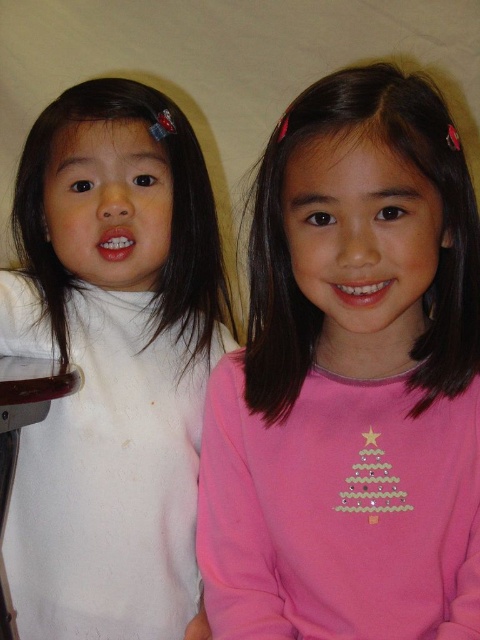
You are a photographer setting up for a group photo. You have two children in front of you, one wearing a pink matte shirt at center and the other wearing a white soft sweater at left. To ensure both are framed properly, which child should you position closer to the camera to make them appear the same height in the photo?

The pink matte shirt at center is not as tall as the white soft sweater at left, so you should position the child in the pink matte shirt at center closer to the camera to make them appear the same height in the photo.

You are taking a photo of two children in a room with a plain light wall. You notice two points marked in the image. The first point is at coordinate point [395,609] and the second is at point [60,97]. Which point is nearer to the camera?

Point [395,609] is closer to the camera than point [60,97] according to the description.

You are a photographer setting up a camera in the scene. You need to place a small light source at point (350,380). What object will the light source be placed on?

The light source will be placed on the pink matte shirt at center located at point (350,380).